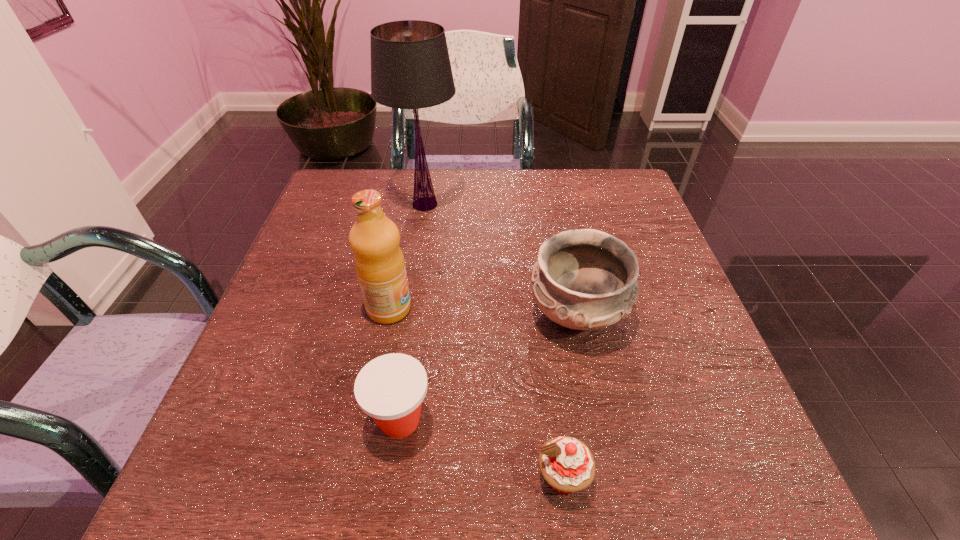
At what (x,y) coordinates should I click in order to perform the action: click on free spot that satisfies the following two spatial constraints: 1. on the front label of the fourth shortest object; 2. on the right side of the Dixie cup. Please return your answer as a coordinate pair (x, y). The width and height of the screenshot is (960, 540). Looking at the image, I should click on (367, 420).